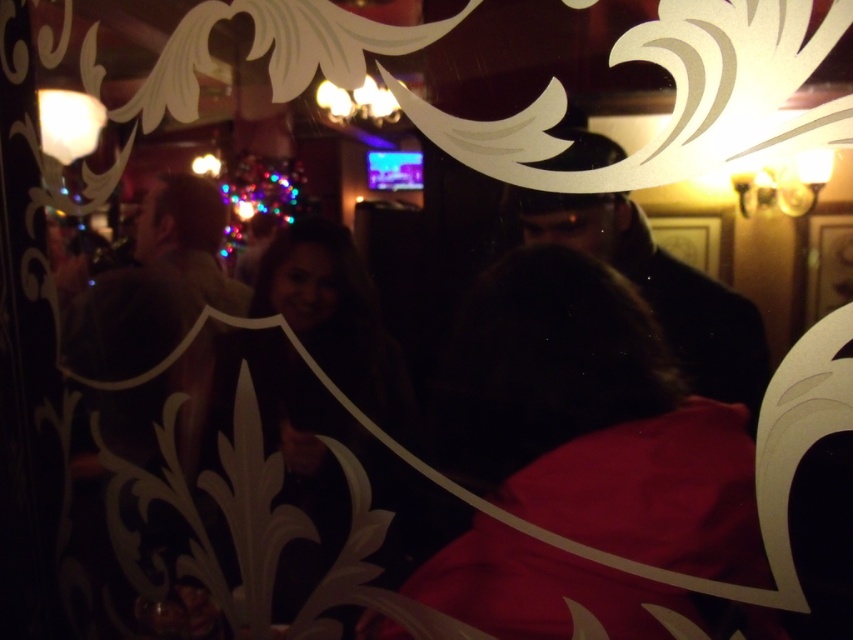
What is the color and texture of the object located at coordinates point [593,420]?

The object at point [593,420] is a matte red coat at center.